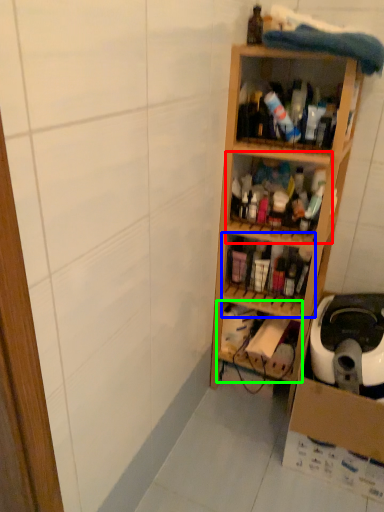
Question: Which is farther away from shelf (highlighted by a red box)? shelf (highlighted by a blue box) or shelf (highlighted by a green box)?

Choices:
 (A) shelf
 (B) shelf

Answer: (B)